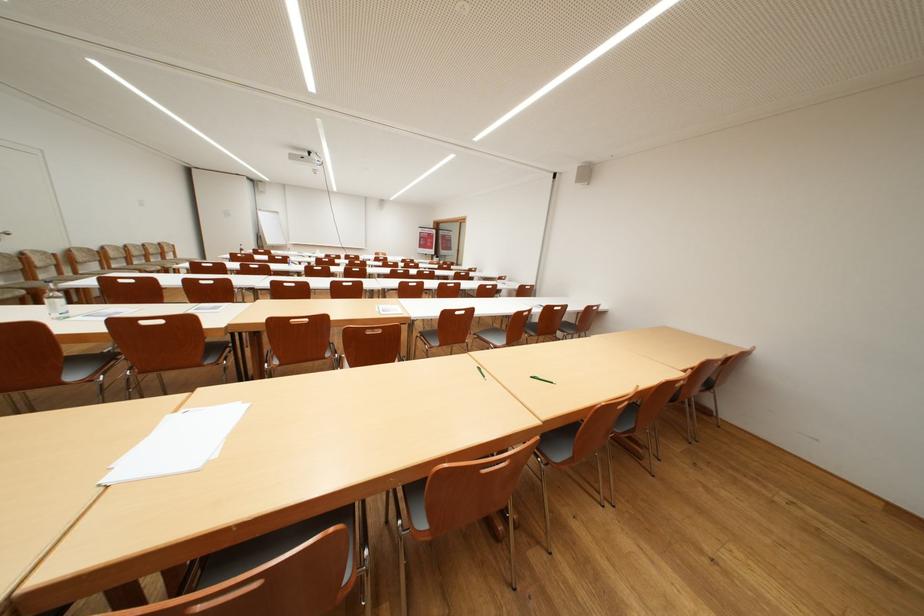
The location [55,302] corresponds to which object?

This point indicates the plastic water bottle.